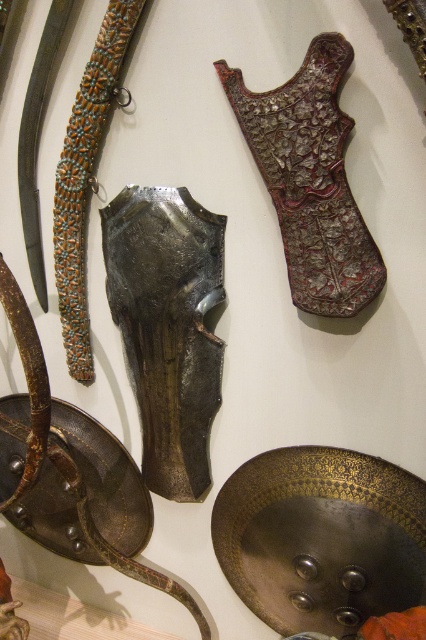
You are a museum curator planning to install a new lighting system. The lighting needs to evenly illuminate both the metallic armor at center and the polished metal sword at center. Given their sizes, which object requires a wider light beam to ensure proper illumination?

The polished metal sword at center requires a wider light beam because it is larger in size compared to the metallic armor at center.

You are a museum curator arranging an exhibition. You want to ensure that the metallic armor at center and the polished metal sword at center are displayed in a way that the armor is visible from above the sword. Is the current arrangement suitable?

The metallic armor at center is located below the polished metal sword at center, so the current arrangement already places the armor below the sword. This means the armor is positioned under the sword, so it might not be visible from above the sword. To have the armor visible from above the sword, the sword should be placed below the armor instead.

You are a museum security guard standing 1.5 meters away from the camera position. You need to inspect the metallic armor at center. Can you reach it without moving closer?

The metallic armor at center is 1.22 meters from camera. Since you are 1.5 meters away from the camera position, the total distance between you and the armor is 2.72 meters. You would need to move closer to inspect it properly.